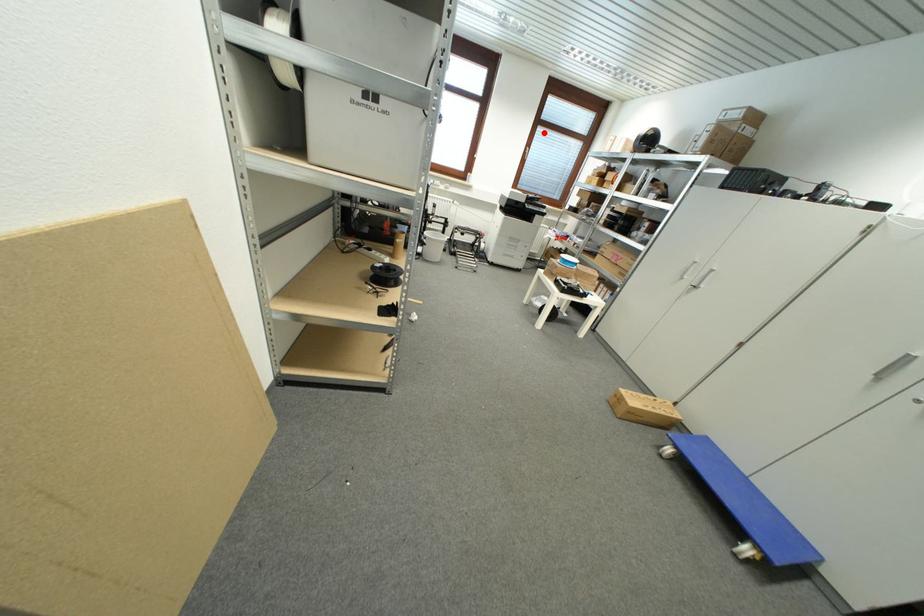
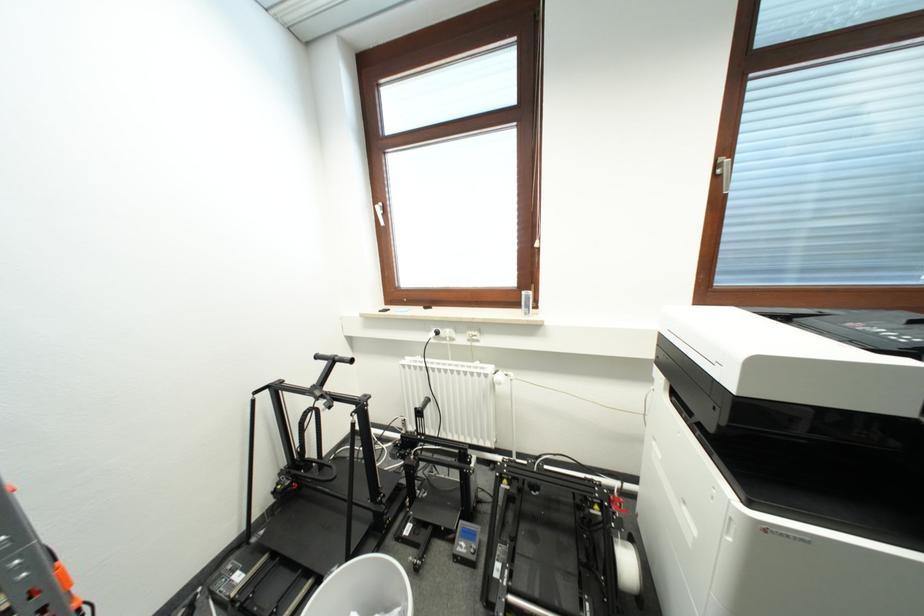
Question: A red point is marked in image1. In image2, is the corresponding 3D point closer to the camera or farther? Reply with the corresponding letter.

Choices:
 (A) The corresponding 3D point is closer.
 (B) The corresponding 3D point is farther.

Answer: (B)